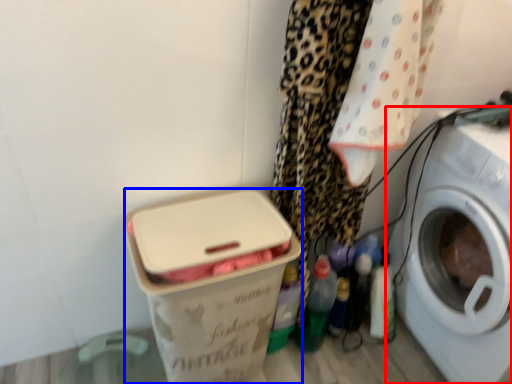
Question: Which object appears farthest to the camera in this image, washing machine (highlighted by a red box) or box (highlighted by a blue box)?

Choices:
 (A) washing machine
 (B) box

Answer: (B)